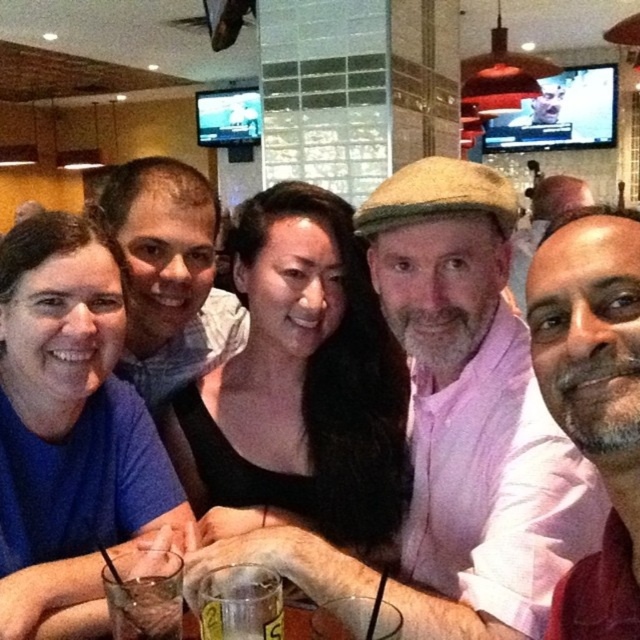
You are a photographer trying to capture a candid shot of the group. You notice a specific point at coordinates (472, 412). Which person in the group is this point located on?

The point at coordinates (472, 412) is located on the pink cotton shirt at center, so it is on the central figure wearing a black top.

You are a photographer trying to capture a candid shot of the two people at the center of the group. The camera you are using has a lens with a minimum focusing distance of 6 inches. Based on the scene, can you determine if the two individuals wearing the pink cotton shirt at center and the black matte shirt at center are within the camera lens focusing range?

The pink cotton shirt at center and black matte shirt at center are 7.04 inches apart. Since the minimum focusing distance is 6 inches, the two individuals are within the camera lens focusing range and can be captured clearly.